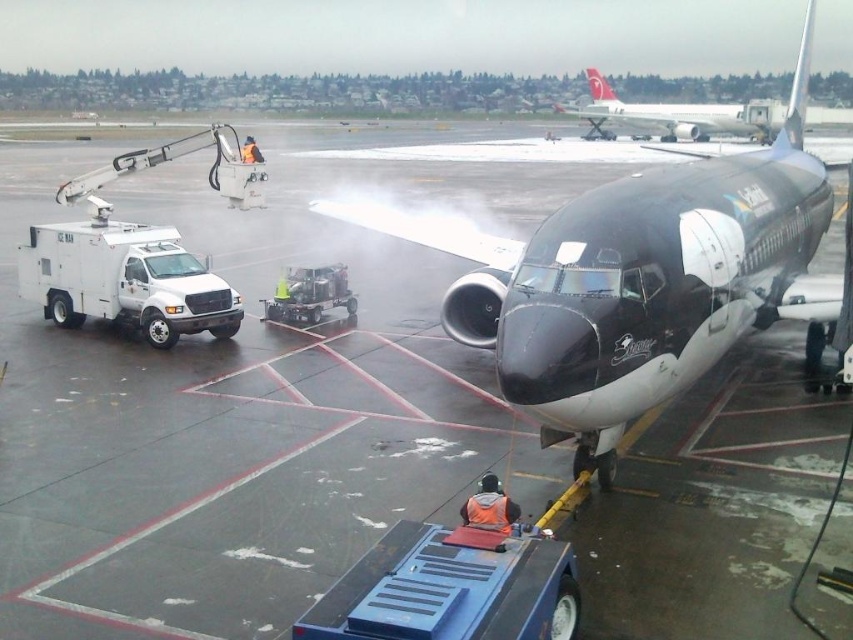
Question: Which of the following is the farthest from the observer?

Choices:
 (A) (651, 205)
 (B) (766, 124)

Answer: (B)

Question: Is shiny black airplane at center to the right of white glossy airplane at upper center from the viewer's perspective?

Choices:
 (A) yes
 (B) no

Answer: (B)

Question: Among these points, which one is farthest from the camera?

Choices:
 (A) (715, 112)
 (B) (817, 224)

Answer: (A)

Question: Which point is farther from the camera taking this photo?

Choices:
 (A) (596, 234)
 (B) (596, 106)

Answer: (B)

Question: Is shiny black airplane at center below white glossy airplane at upper center?

Choices:
 (A) no
 (B) yes

Answer: (B)

Question: Does shiny black airplane at center appear on the right side of white glossy airplane at upper center?

Choices:
 (A) no
 (B) yes

Answer: (A)